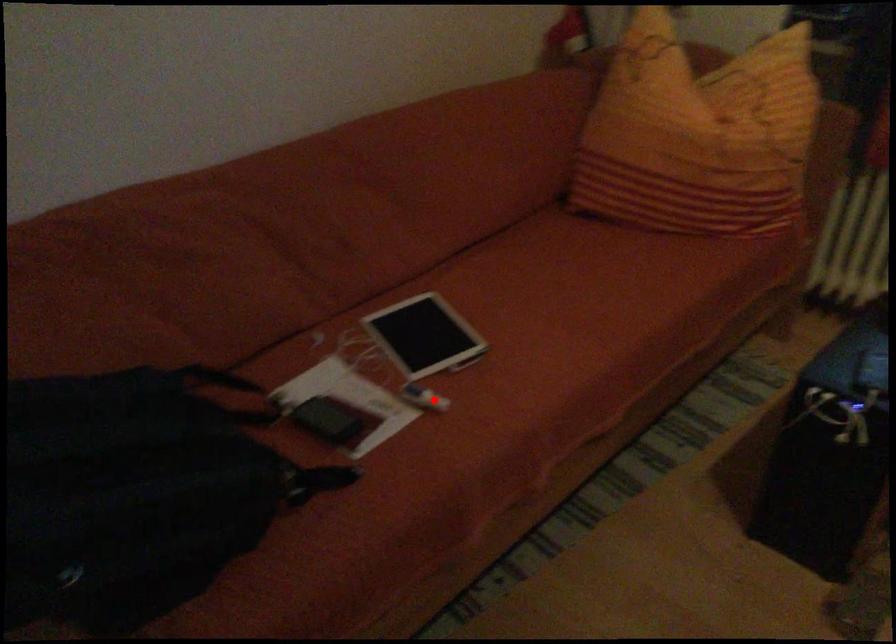
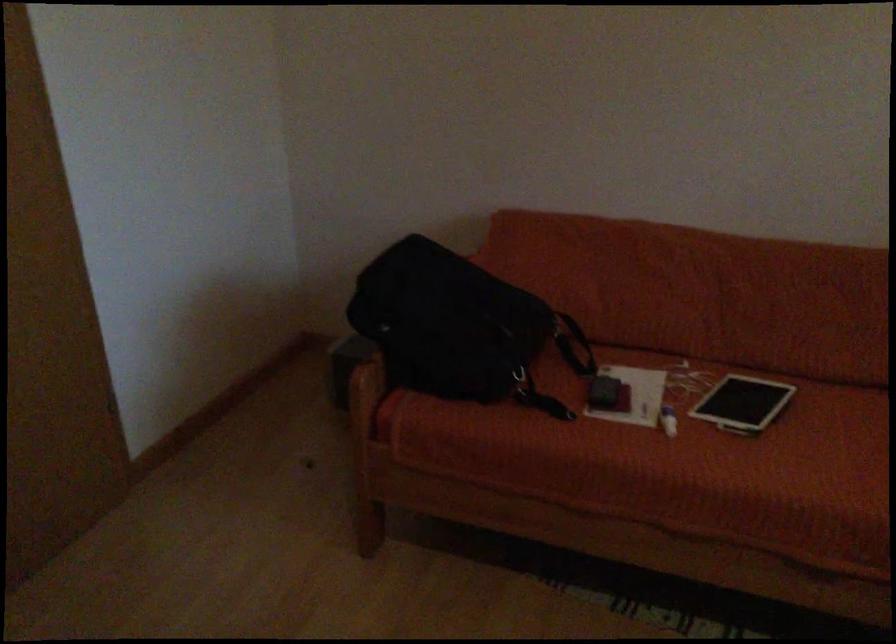
Question: I am providing you with two images of the same scene from different viewpoints. A red point is shown in image1. For the corresponding object point in image2, is it positioned nearer or farther from the camera?

Choices:
 (A) Nearer
 (B) Farther

Answer: (B)